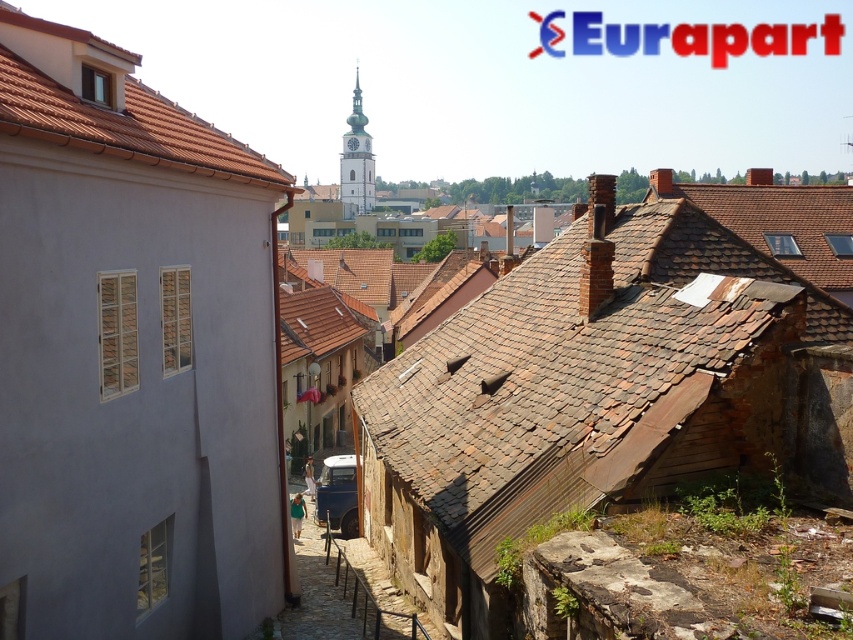
Question: Among these objects, which one is farthest from the camera?

Choices:
 (A) brown shingles at center
 (B) brown tiled roof at upper left

Answer: (A)

Question: Which object is farther from the camera taking this photo?

Choices:
 (A) brown shingles at center
 (B) smooth stone wall at center
 (C) brown tiled roof at upper left

Answer: (B)

Question: Estimate the real-world distances between objects in this image. Which object is farther from the brown shingles at center?

Choices:
 (A) brown tiled roof at upper left
 (B) smooth stone wall at center

Answer: (A)

Question: Is brown shingles at center wider than brown tiled roof at upper left?

Choices:
 (A) no
 (B) yes

Answer: (B)

Question: Can you confirm if brown tiled roof at upper left is positioned to the right of smooth stone wall at center?

Choices:
 (A) no
 (B) yes

Answer: (A)

Question: Can you confirm if brown shingles at center is thinner than brown tiled roof at upper left?

Choices:
 (A) yes
 (B) no

Answer: (B)